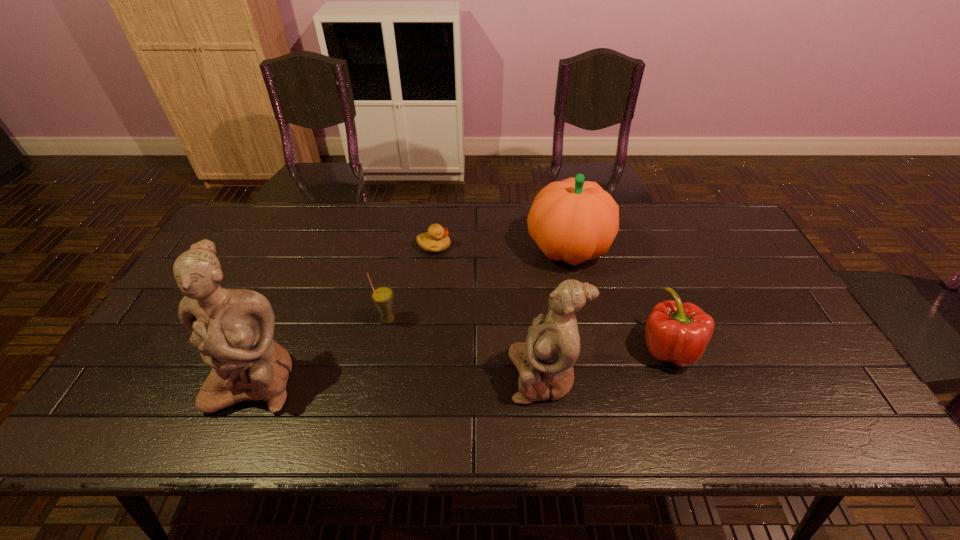
Where is `vacant space at the far left corner of the desktop`? This screenshot has width=960, height=540. vacant space at the far left corner of the desktop is located at coordinates (234, 213).

The image size is (960, 540). Find the location of `vacant space at the near left corner of the desktop`. vacant space at the near left corner of the desktop is located at coordinates (180, 389).

Image resolution: width=960 pixels, height=540 pixels. In order to click on vacant space at the far right corner of the desktop in this screenshot , I will do `click(676, 201)`.

This screenshot has height=540, width=960. Find the location of `free region at the near right corner`. free region at the near right corner is located at coordinates (802, 383).

At what (x,y) coordinates should I click in order to perform the action: click on vacant area between the duckling and the taller figurine. Please return your answer as a coordinate pair (x, y). Looking at the image, I should click on (345, 313).

You are a GUI agent. You are given a task and a screenshot of the screen. Output one action in this format:
    pyautogui.click(x=<x>, y=<y>)
    Task: Click on the vacant region between the pepper and the pumpkin
    This screenshot has height=540, width=960.
    Given the screenshot: What is the action you would take?
    pyautogui.click(x=618, y=299)

At what (x,y) coordinates should I click in order to perform the action: click on free space that is in between the pumpkin and the duckling. Please return your answer as a coordinate pair (x, y). This screenshot has height=540, width=960. Looking at the image, I should click on (501, 247).

Where is `vacant space in between the right figurine and the pepper`? This screenshot has height=540, width=960. vacant space in between the right figurine and the pepper is located at coordinates (606, 362).

Locate an element on the screen. The width and height of the screenshot is (960, 540). free area in between the pepper and the taller figurine is located at coordinates (462, 363).

Locate an element on the screen. This screenshot has height=540, width=960. vacant space in between the shorter figurine and the third object from left to right is located at coordinates (489, 311).